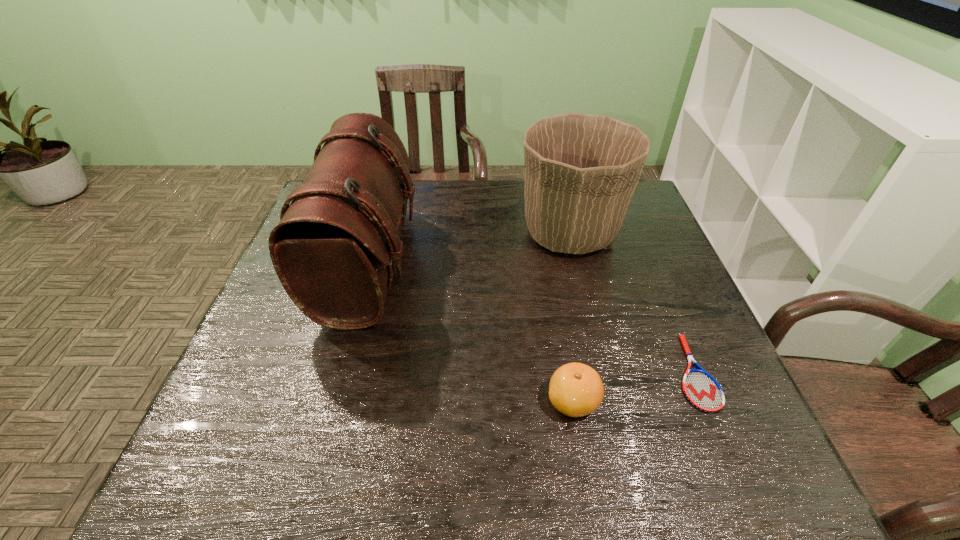
Where is `the leftmost object`? Image resolution: width=960 pixels, height=540 pixels. the leftmost object is located at coordinates (334, 248).

This screenshot has height=540, width=960. I want to click on flowerpot, so click(x=581, y=170).

The image size is (960, 540). I want to click on clementine, so click(575, 389).

Locate an element on the screen. the shortest object is located at coordinates (700, 388).

The image size is (960, 540). What are the coordinates of `vacant space situated 0.140m on the front-facing side of the satchel` in the screenshot? It's located at (468, 264).

Identify the location of blank space located 0.070m on the right of the flowerpot. This screenshot has width=960, height=540. (x=648, y=233).

The height and width of the screenshot is (540, 960). I want to click on free space located on the back of the clementine, so click(558, 315).

Find the location of a particular element. Image resolution: width=960 pixels, height=540 pixels. vacant space located on the left of the shortest object is located at coordinates (566, 373).

Identify the location of satchel situated at the far edge. Image resolution: width=960 pixels, height=540 pixels. pyautogui.click(x=334, y=248).

Locate an element on the screen. The image size is (960, 540). flowerpot that is at the far edge is located at coordinates (581, 170).